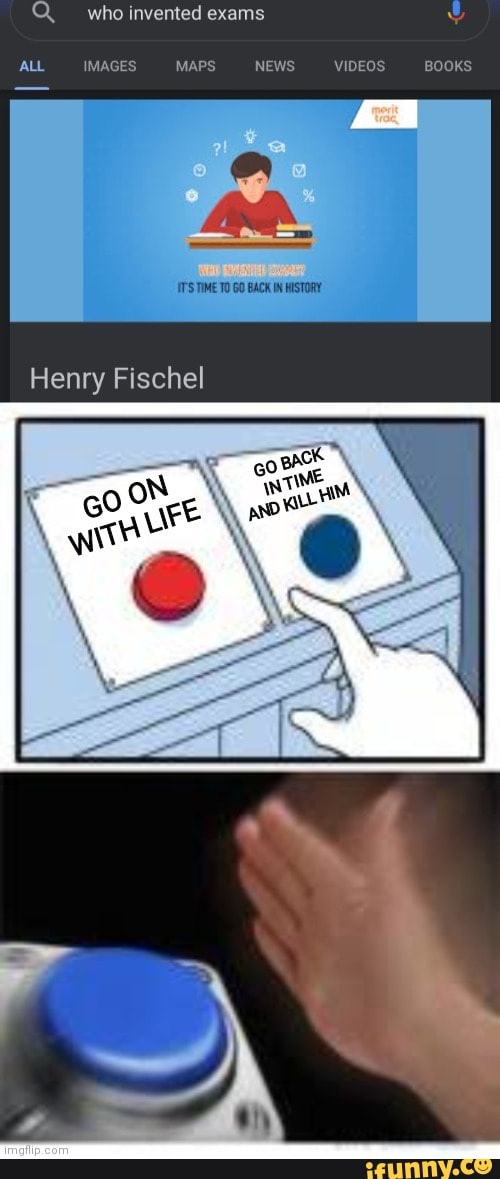
Identify the location of wooden desk. (234, 241).